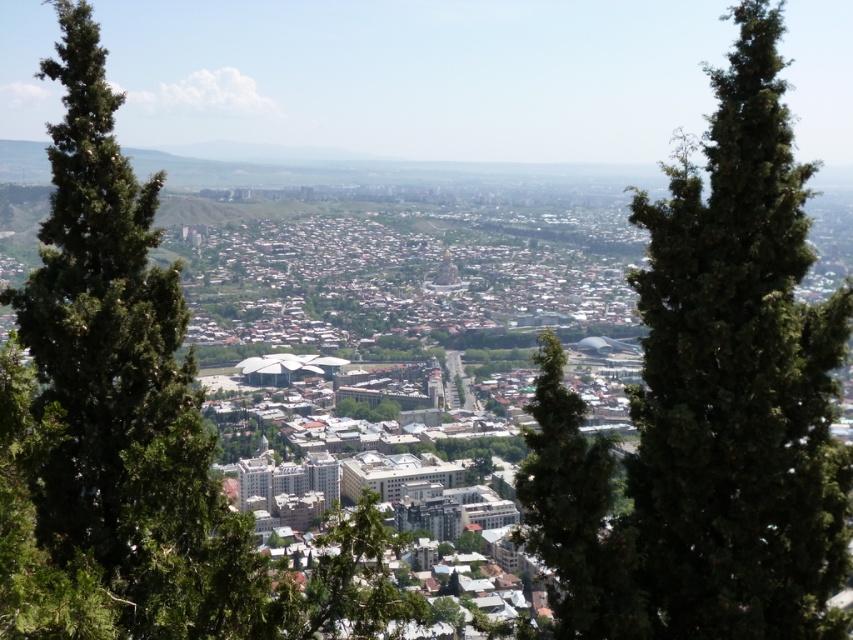
Find the location of a particular element. The image size is (853, 640). green textured tree at center is located at coordinates [709, 404].

Is green textured tree at center wider than green leafy tree at left?

In fact, green textured tree at center might be narrower than green leafy tree at left.

This screenshot has width=853, height=640. I want to click on green textured tree at center, so click(709, 404).